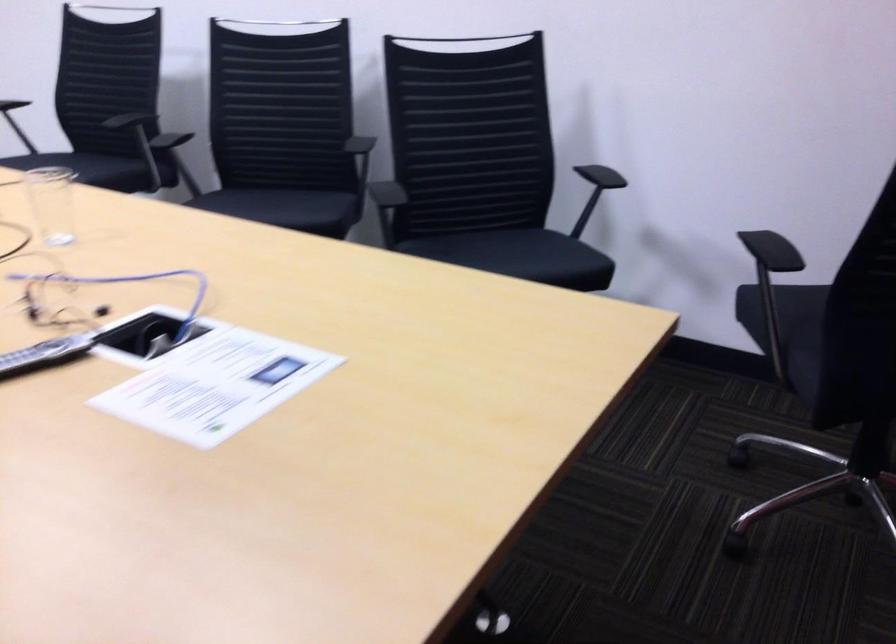
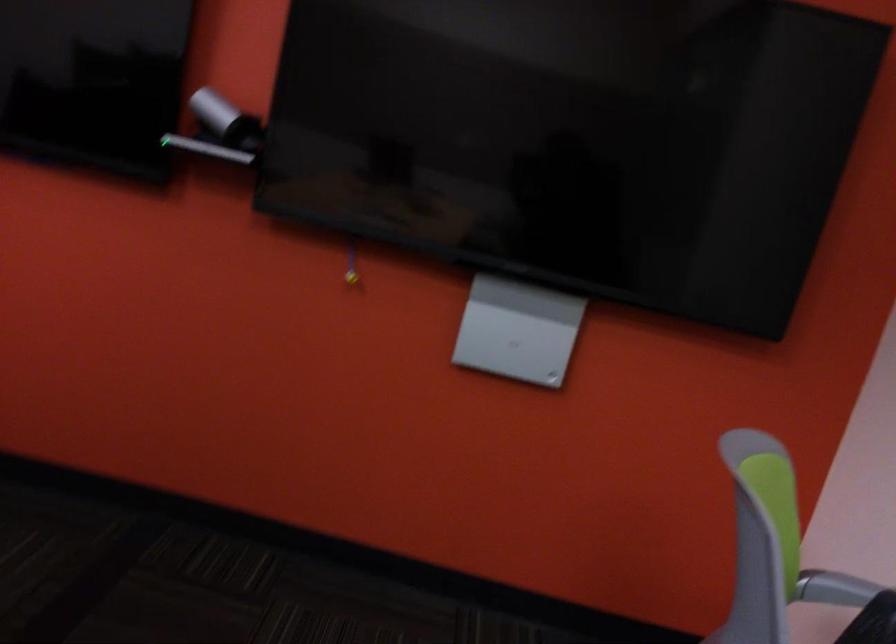
Based on the continuous images, in which direction is the camera rotating?

The rotation direction of the camera is right-down.